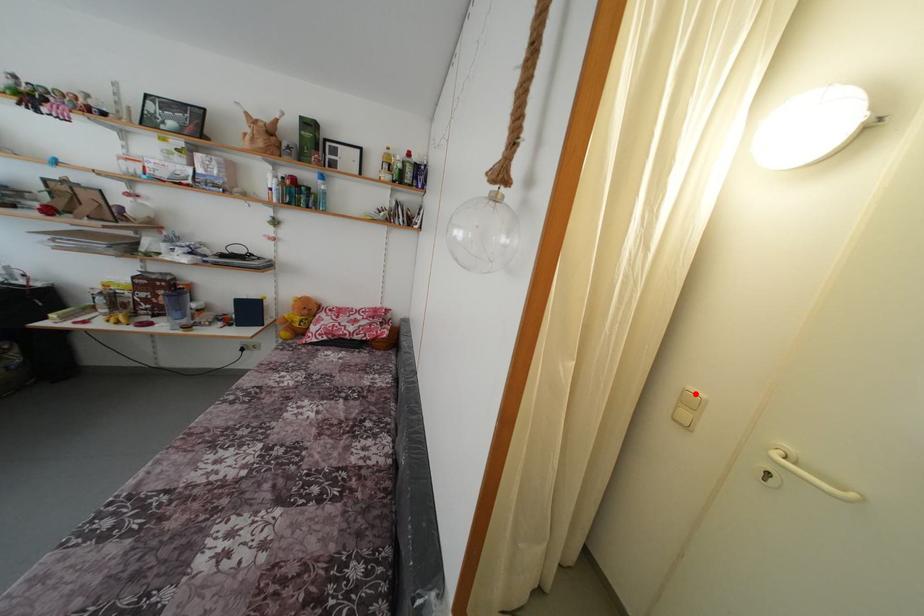
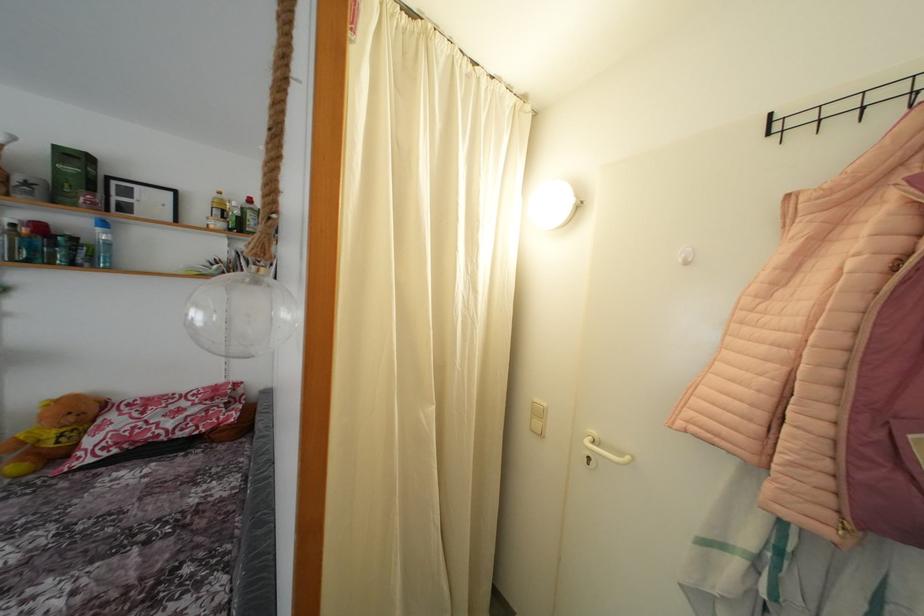
The point at the highlighted location is marked in the first image. Where is the corresponding point in the second image?

(541, 406)